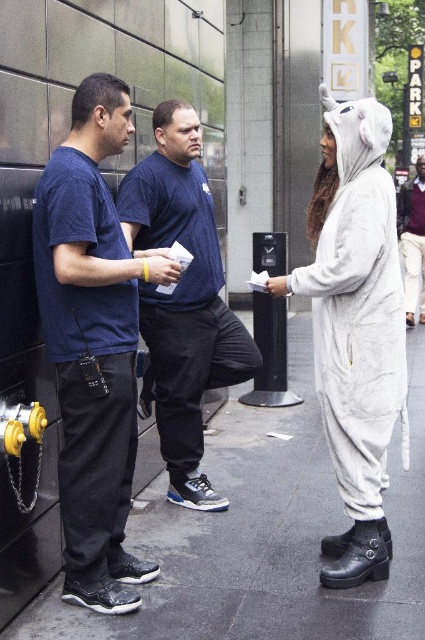
Question: Considering the real-world distances, which object is farthest from the white plush onesie at right?

Choices:
 (A) black rubber pavement at lower center
 (B) dark blue t-shirt at left
 (C) dark blue t-shirt at center
 (D) white plush onesie at center

Answer: (D)

Question: Among these objects, which one is nearest to the camera?

Choices:
 (A) dark blue t-shirt at center
 (B) white plush onesie at center
 (C) white plush onesie at right
 (D) dark blue t-shirt at left

Answer: (D)

Question: Considering the relative positions of white plush onesie at right and dark blue t-shirt at center in the image provided, where is white plush onesie at right located with respect to dark blue t-shirt at center?

Choices:
 (A) below
 (B) above

Answer: (A)

Question: Is dark blue t-shirt at center below white plush onesie at center?

Choices:
 (A) no
 (B) yes

Answer: (B)

Question: Which is farther from the white plush onesie at center?

Choices:
 (A) dark blue t-shirt at left
 (B) white plush onesie at right
 (C) dark blue t-shirt at center
 (D) black rubber pavement at lower center

Answer: (A)

Question: Considering the relative positions of black rubber pavement at lower center and white plush onesie at center in the image provided, where is black rubber pavement at lower center located with respect to white plush onesie at center?

Choices:
 (A) below
 (B) above

Answer: (A)